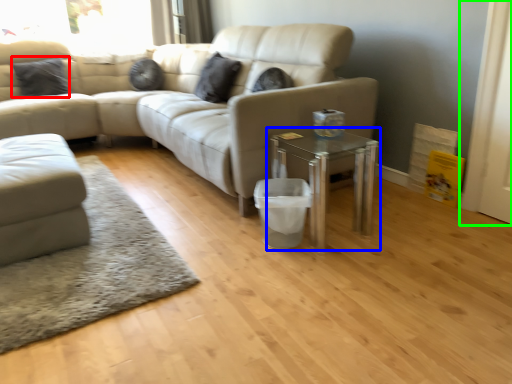
Question: Which is farther away from pillow (highlighted by a red box)? table (highlighted by a blue box) or screen door (highlighted by a green box)?

Choices:
 (A) table
 (B) screen door

Answer: (B)